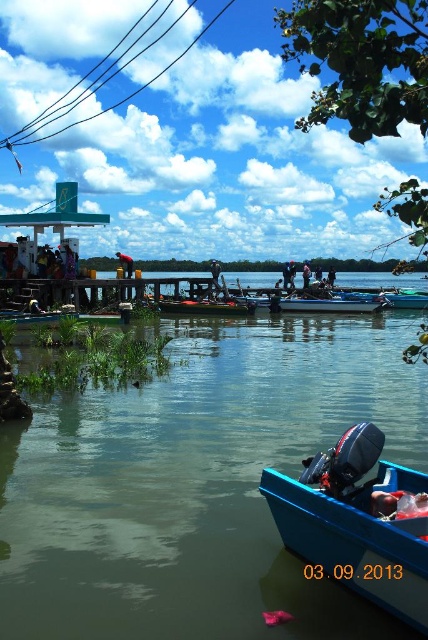
You are planning to transport a large piece of equipment that requires a wide vessel. Based on the scene, which boat between the blue plastic boat at lower right and the wooden boat at center would be more suitable for your needs?

The blue plastic boat at lower right might be wider than wooden boat at center, so it would be more suitable for transporting large equipment requiring a wide vessel.